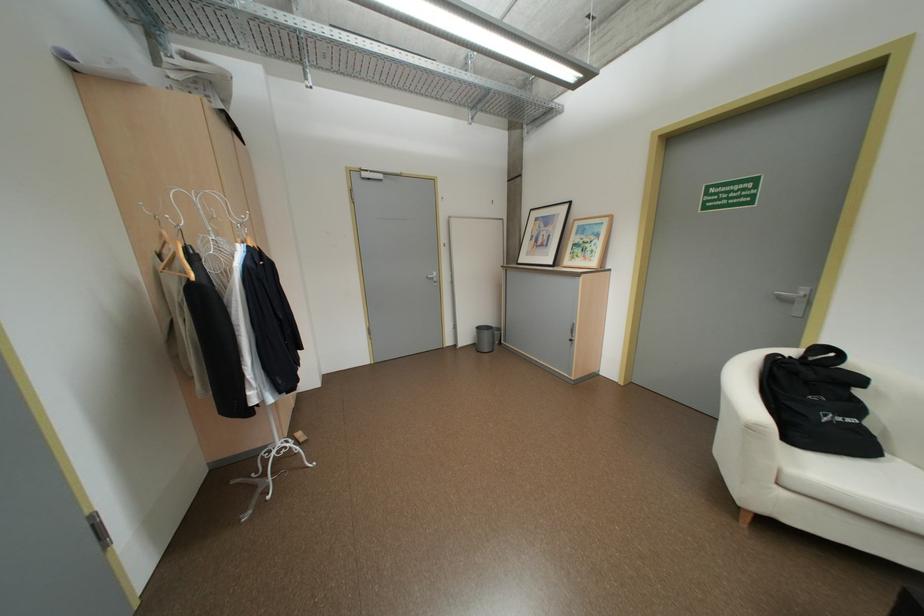
Where is `cabinet door handle`? Image resolution: width=924 pixels, height=616 pixels. cabinet door handle is located at coordinates (572, 331).